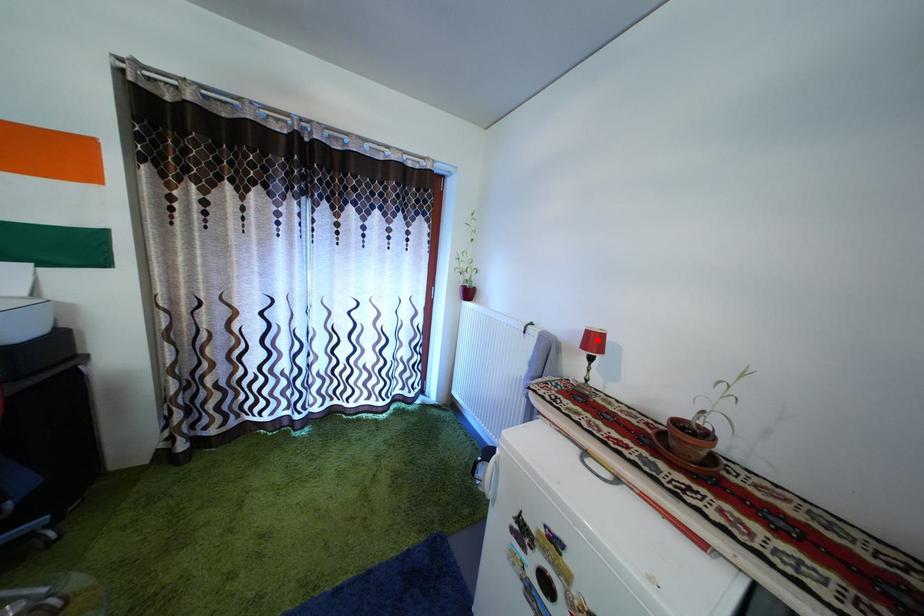
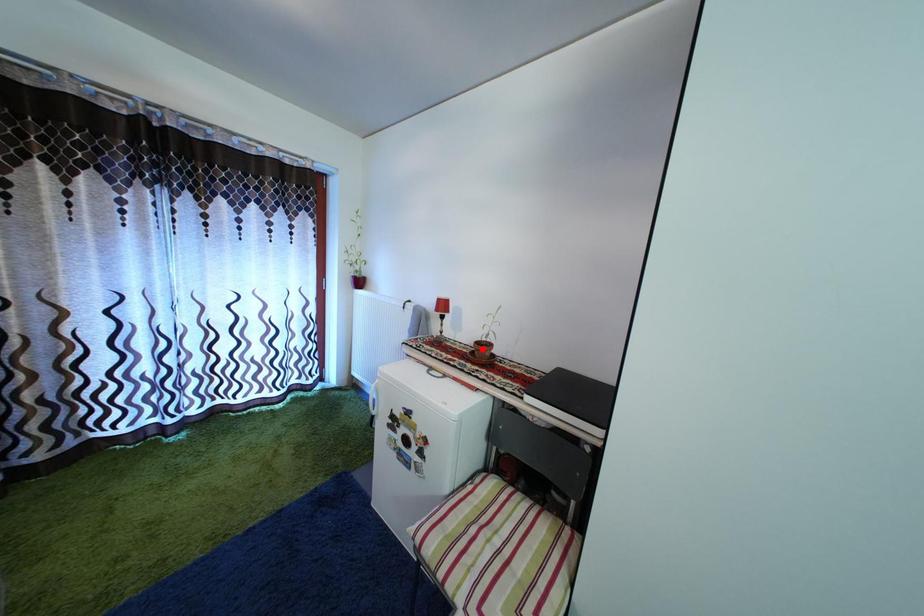
I am providing you with two images of the same scene from different viewpoints. A red point is marked on the first image and another point is marked on the second image. Are the points marked in image1 and image2 representing the same 3D position?

No